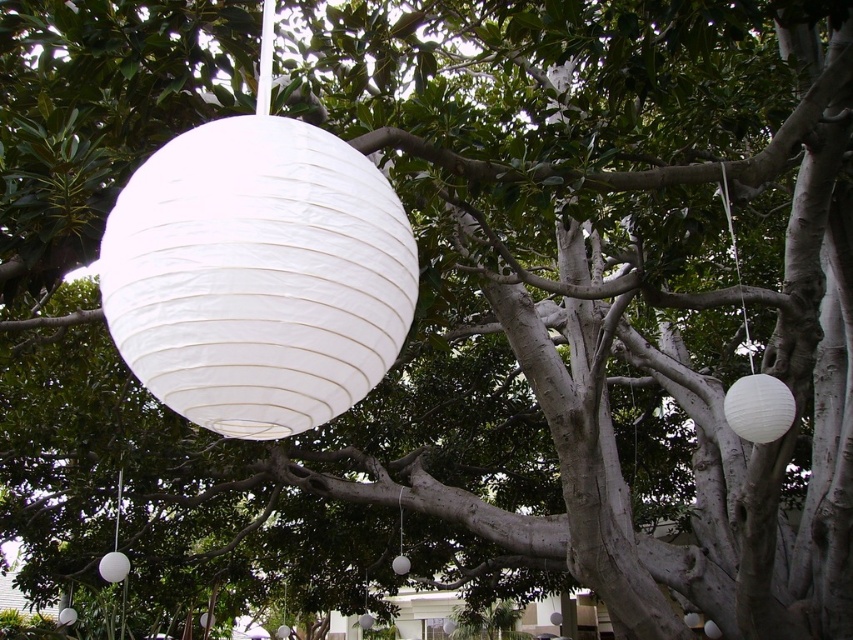
Between white paper lamp at lower left and white paper lantern at center, which one has less height?

white paper lamp at lower left is shorter.

Is point (112, 552) closer to camera compared to point (399, 544)?

Yes, point (112, 552) is closer to viewer.

Identify the location of white paper lamp at lower left. (115, 547).

Can you confirm if white paper lantern at upper center is wider than white paper lantern at right?

Yes, white paper lantern at upper center is wider than white paper lantern at right.

Is white paper lantern at upper center shorter than white paper lantern at right?

No, white paper lantern at upper center is not shorter than white paper lantern at right.

Between point (209, 316) and point (782, 406), which one is positioned in front?

Point (209, 316) is more forward.

The width and height of the screenshot is (853, 640). In order to click on white paper lantern at upper center in this screenshot , I will do tap(257, 275).

From the picture: Can you confirm if white paper lantern at right is bigger than white paper lantern at lower left?

Yes.

Is the position of white paper lantern at right more distant than that of white paper lantern at lower left?

That is False.

The width and height of the screenshot is (853, 640). In order to click on white paper lantern at right in this screenshot , I will do `click(758, 406)`.

Where is `white paper lantern at right`? The width and height of the screenshot is (853, 640). white paper lantern at right is located at coordinates (758, 406).